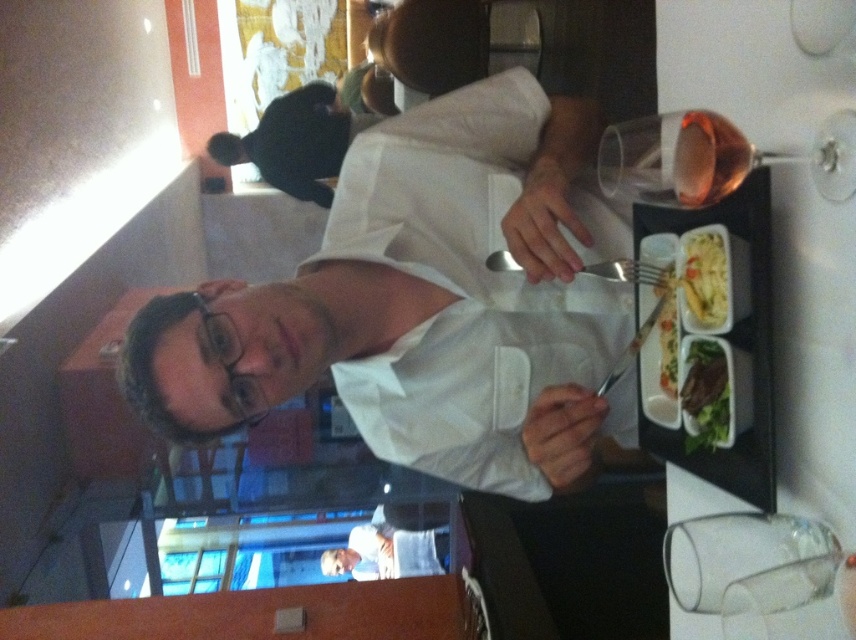
Question: Is white matte shirt at upper center wider than green leafy salad at upper right?

Choices:
 (A) no
 (B) yes

Answer: (B)

Question: Can you confirm if black matte jacket at upper center is positioned below green leafy salad at upper right?

Choices:
 (A) no
 (B) yes

Answer: (A)

Question: Which of these objects is positioned farthest from the white glossy pasta at upper right?

Choices:
 (A) white matte shirt at upper center
 (B) green leafy salad at upper right
 (C) transparent plastic glasses at upper center
 (D) silver metallic fork at center

Answer: (C)

Question: Which object is the closest to the green leafy salad at upper right?

Choices:
 (A) silver metallic fork at center
 (B) black matte jacket at upper center
 (C) white glossy pasta at upper right

Answer: (C)

Question: Does rosé glass at upper right have a larger size compared to white glossy pasta at upper right?

Choices:
 (A) no
 (B) yes

Answer: (B)

Question: Which object is the farthest from the white glossy pasta at upper right?

Choices:
 (A) rosé glass at upper right
 (B) transparent plastic glasses at upper center
 (C) green leafy vegetables at right
 (D) green leafy salad at upper right

Answer: (B)